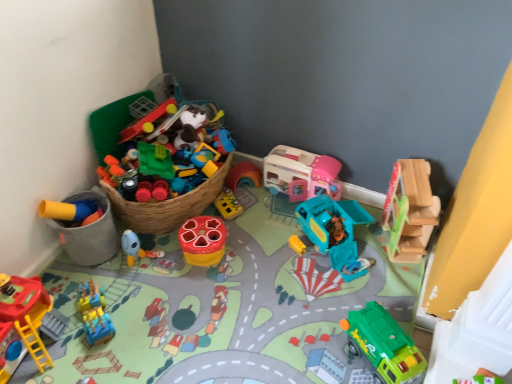
Where is `empty space that is to the right of blue plastic train at lower left, acting as the seventh toy starting from the right`? empty space that is to the right of blue plastic train at lower left, acting as the seventh toy starting from the right is located at coordinates (149, 314).